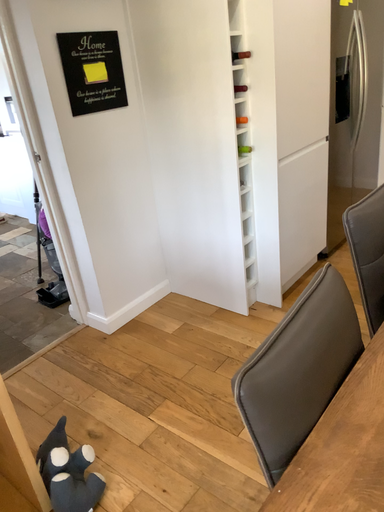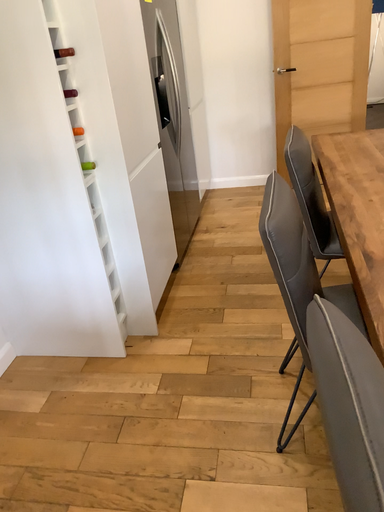
Question: Which way did the camera rotate in the video?

Choices:
 (A) rotated right
 (B) rotated left

Answer: (A)